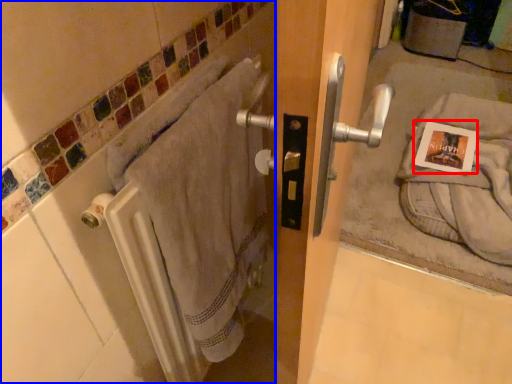
Question: Among these objects, which one is farthest to the camera, postcard (highlighted by a red box) or bath (highlighted by a blue box)?

Choices:
 (A) postcard
 (B) bath

Answer: (A)